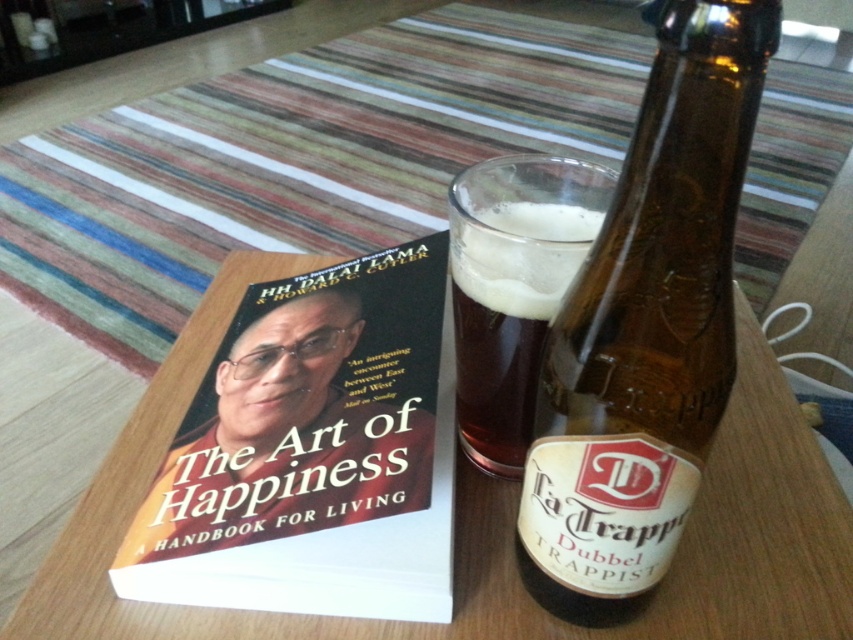
Does point (646, 380) lie behind point (498, 365)?

No, (646, 380) is in front of (498, 365).

Does brown glass beer bottle at center have a greater height compared to dark amber glass at center?

Indeed, brown glass beer bottle at center has a greater height compared to dark amber glass at center.

Find the location of a particular element. brown glass beer bottle at center is located at coordinates (646, 324).

Does brown glass beer bottle at center have a greater width compared to wooden table at center?

No, brown glass beer bottle at center is not wider than wooden table at center.

Can you confirm if brown glass beer bottle at center is smaller than wooden table at center?

Correct, brown glass beer bottle at center occupies less space than wooden table at center.

Is point (630, 230) farther from viewer compared to point (718, 540)?

No, it is in front of (718, 540).

Locate an element on the screen. The width and height of the screenshot is (853, 640). brown glass beer bottle at center is located at coordinates (646, 324).

Which is below, white paper book at center or dark amber glass at center?

Positioned lower is white paper book at center.

What do you see at coordinates (312, 452) in the screenshot? I see `white paper book at center` at bounding box center [312, 452].

At what (x,y) coordinates should I click in order to perform the action: click on white paper book at center. Please return your answer as a coordinate pair (x, y). The image size is (853, 640). Looking at the image, I should click on (312, 452).